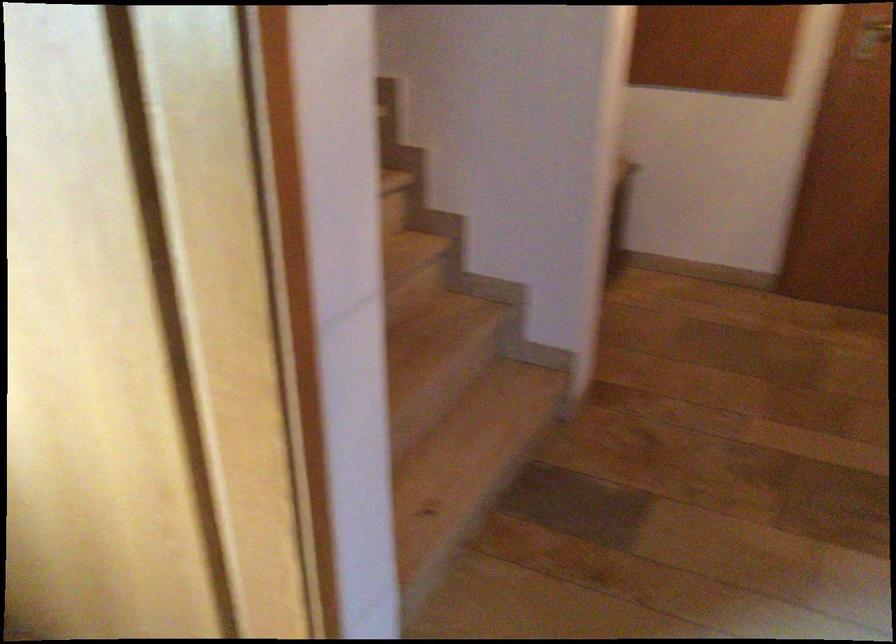
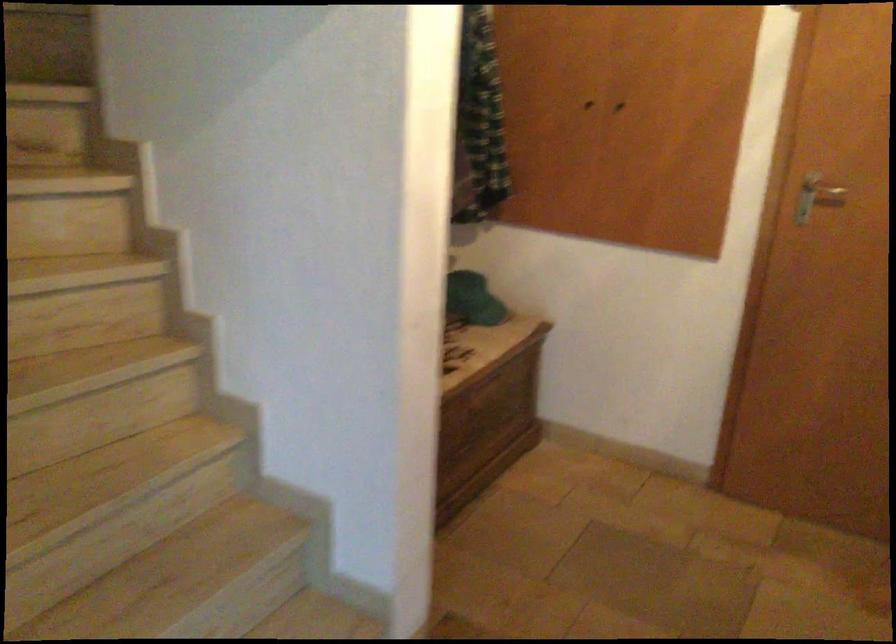
What movement of the cameraman would produce the second image?

The cameraman walked toward right, forward.